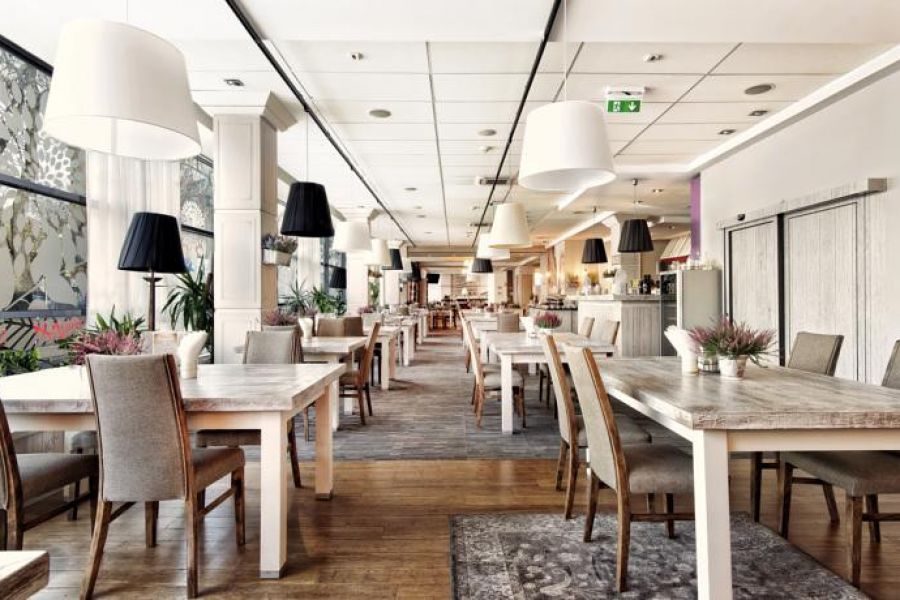
Find the location of a particular element. This screenshot has width=900, height=600. table is located at coordinates (286, 382), (342, 338), (384, 328), (406, 328), (416, 318), (664, 381), (515, 342), (491, 325), (478, 317), (468, 311).